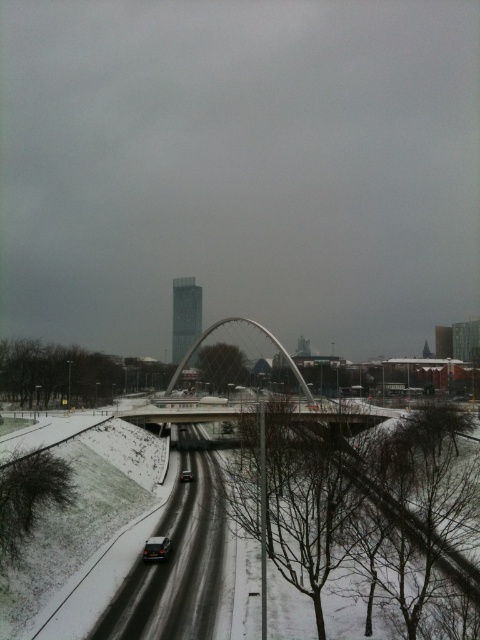
Question: Is black asphalt road at lower center closer to camera compared to concrete bridge at center?

Choices:
 (A) no
 (B) yes

Answer: (B)

Question: Which of the following is the closest to the observer?

Choices:
 (A) concrete bridge at center
 (B) glassy steel bridge at center
 (C) black asphalt road at lower center

Answer: (C)

Question: Does glassy steel bridge at center have a greater width compared to dark gray metallic car at lower center?

Choices:
 (A) yes
 (B) no

Answer: (A)

Question: Which of the following is the closest to the observer?

Choices:
 (A) concrete bridge at center
 (B) dark gray metallic car at lower center

Answer: (A)

Question: Which point appears farthest from the camera in this image?

Choices:
 (A) (178, 512)
 (B) (162, 554)

Answer: (A)

Question: Is the position of black asphalt road at lower center less distant than that of dark gray metallic car at lower center?

Choices:
 (A) no
 (B) yes

Answer: (B)